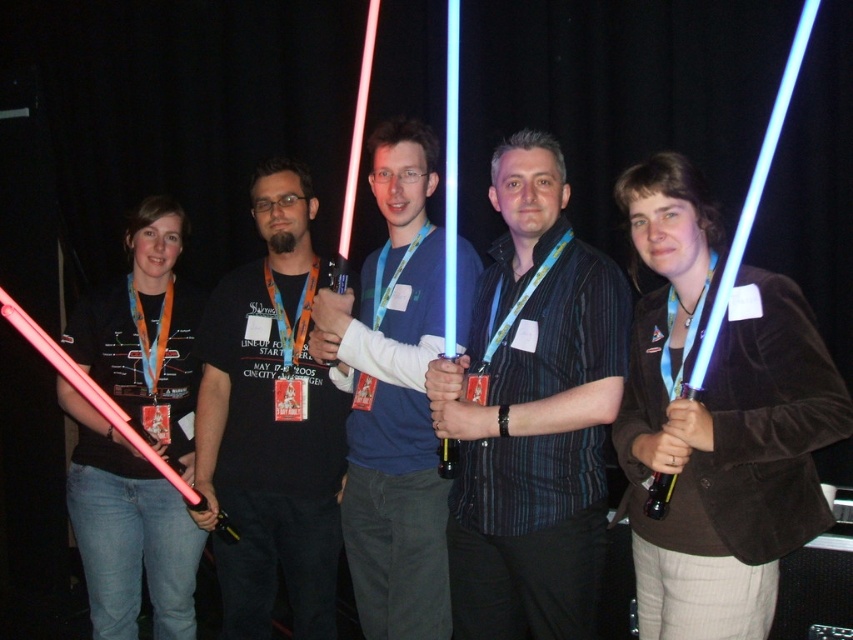
You are standing in the convention hall and see two points of light, point (x=523, y=145) and point (x=267, y=390). Which one is closer to you?

Point (x=523, y=145) is in front of point (x=267, y=390), so it is closer to you.

You are a photographer at the event and want to capture a closeup shot of both the shiny blue light saber at center and the matte plastic lightsaber at center without any overlap. Given that your camera can focus on objects within a 25 cm range, will you be able to achieve this?

The shiny blue light saber at center and the matte plastic lightsaber at center are 25.68 centimeters apart from each other. Since the distance between them exceeds the camera focus range of 25 cm, capturing both without overlap may not be possible.